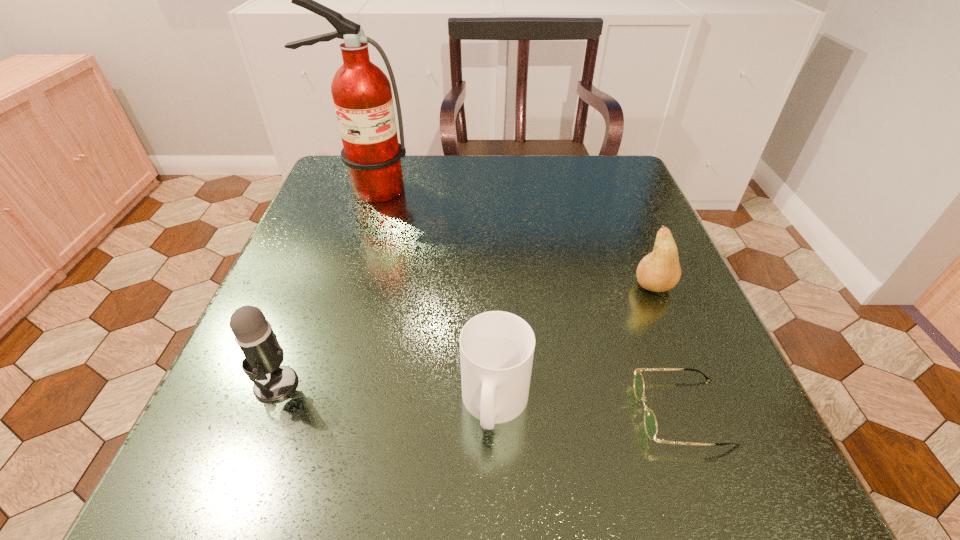
The height and width of the screenshot is (540, 960). In order to click on vacant space located 0.160m on the lenses of the shortest object in this screenshot , I will do `click(523, 412)`.

Where is `free space located on the lenses of the shortest object`? free space located on the lenses of the shortest object is located at coordinates (501, 412).

Identify the location of free location located 0.400m on the lenses of the shortest object. This screenshot has width=960, height=540. (350, 412).

Find the location of a particular element. object at the far edge is located at coordinates (362, 95).

This screenshot has width=960, height=540. I want to click on mug that is at the near edge, so click(496, 348).

Locate an element on the screen. This screenshot has width=960, height=540. spectacles present at the near edge is located at coordinates (650, 422).

Locate an element on the screen. The width and height of the screenshot is (960, 540). fire extinguisher that is at the left edge is located at coordinates (362, 95).

You are a GUI agent. You are given a task and a screenshot of the screen. Output one action in this format:
    pyautogui.click(x=<x>, y=<y>)
    Task: Click on the microphone located at the left edge
    
    Given the screenshot: What is the action you would take?
    pyautogui.click(x=254, y=335)

The height and width of the screenshot is (540, 960). I want to click on pear that is at the right edge, so click(x=659, y=271).

Where is `spectacles that is at the right edge`? This screenshot has width=960, height=540. spectacles that is at the right edge is located at coordinates (650, 422).